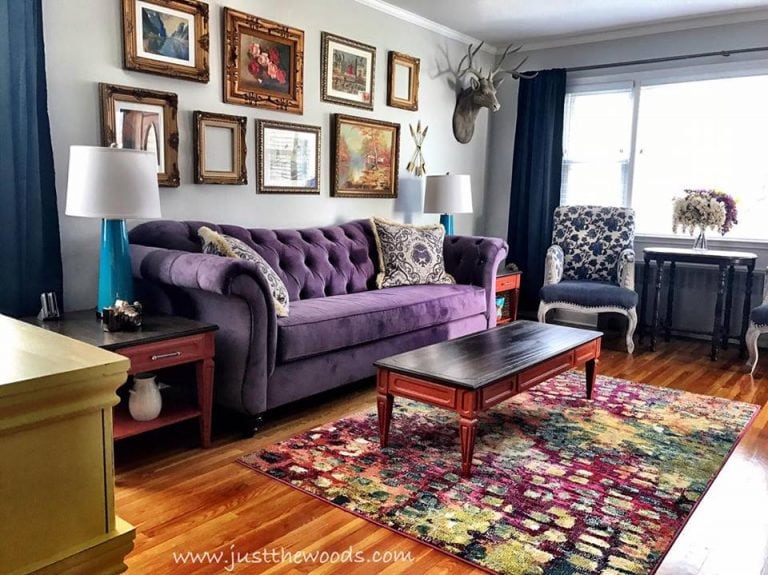
Where is `hung wall art`? The width and height of the screenshot is (768, 575). hung wall art is located at coordinates (160, 38), (143, 130), (250, 60), (223, 144), (336, 75), (296, 164), (402, 80), (372, 164).